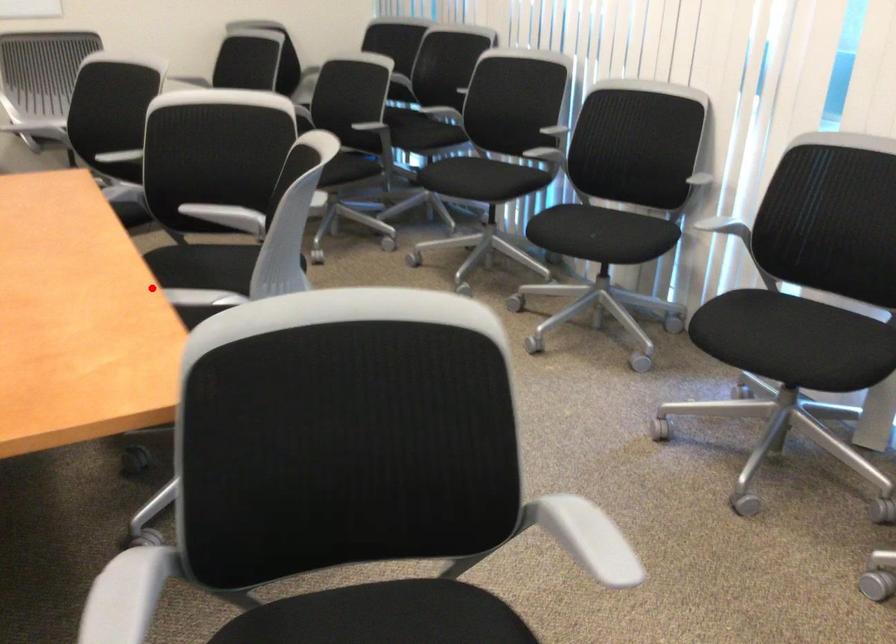
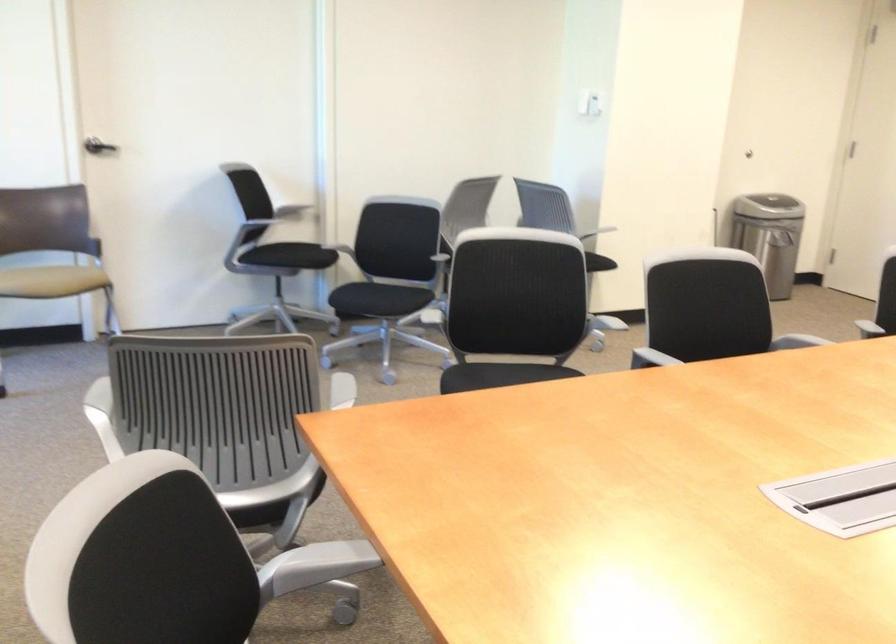
Question: A red point is marked in image1. In image2, is the corresponding 3D point closer to the camera or farther? Reply with the corresponding letter.

Choices:
 (A) The corresponding 3D point is closer.
 (B) The corresponding 3D point is farther.

Answer: (A)